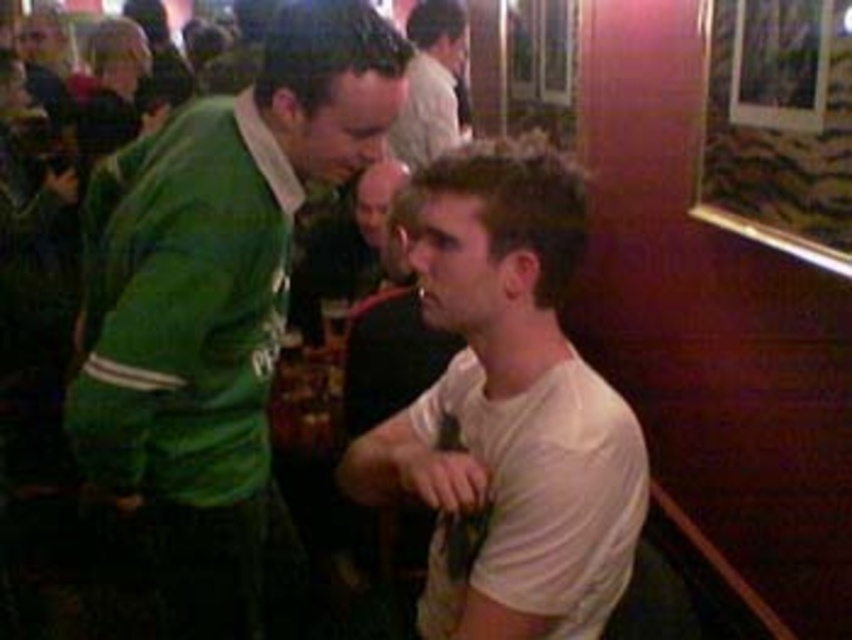
Question: Observing the image, what is the correct spatial positioning of green jersey at center in reference to white t-shirt at center?

Choices:
 (A) left
 (B) right

Answer: (A)

Question: Among these points, which one is nearest to the camera?

Choices:
 (A) (542, 529)
 (B) (456, 42)
 (C) (380, 51)

Answer: (A)

Question: Does white matte shirt at center come behind white t-shirt at center?

Choices:
 (A) yes
 (B) no

Answer: (B)

Question: Which point is farther to the camera?

Choices:
 (A) (556, 180)
 (B) (237, 560)

Answer: (B)

Question: Which point is closer to the camera taking this photo?

Choices:
 (A) (594, 419)
 (B) (446, 49)
 (C) (222, 289)

Answer: (A)

Question: Is green jersey at center to the left of white t-shirt at center from the viewer's perspective?

Choices:
 (A) yes
 (B) no

Answer: (A)